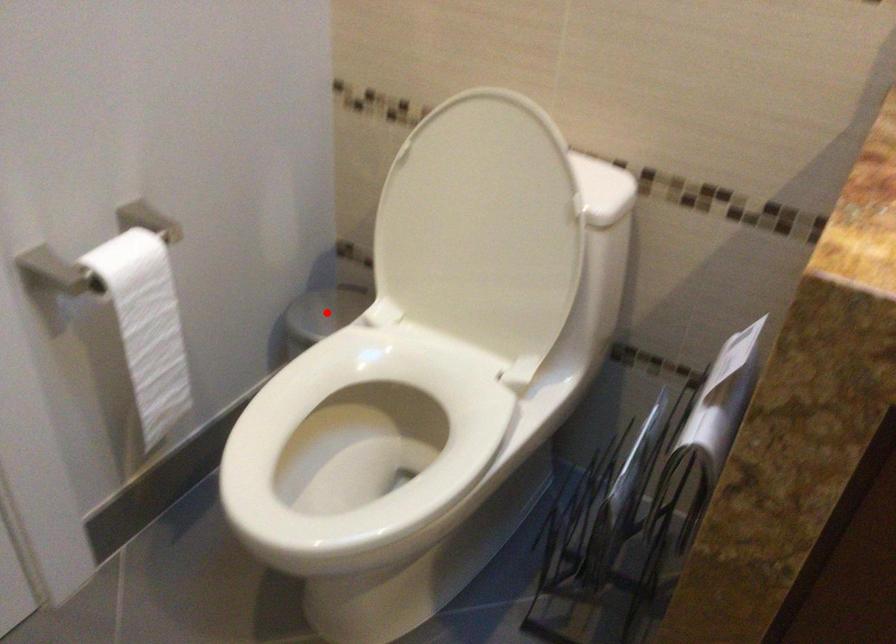
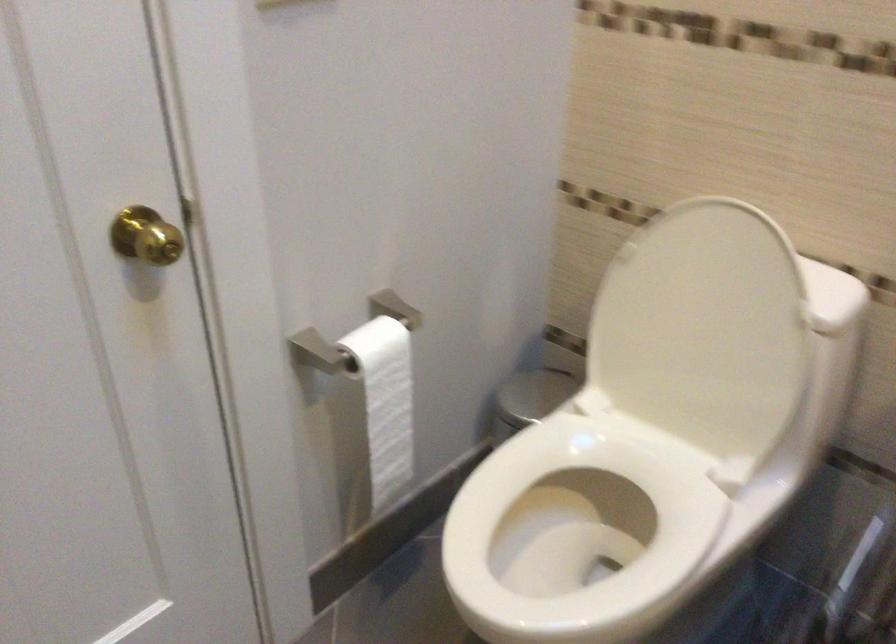
The point at the highlighted location is marked in the first image. Where is the corresponding point in the second image?

(532, 395)